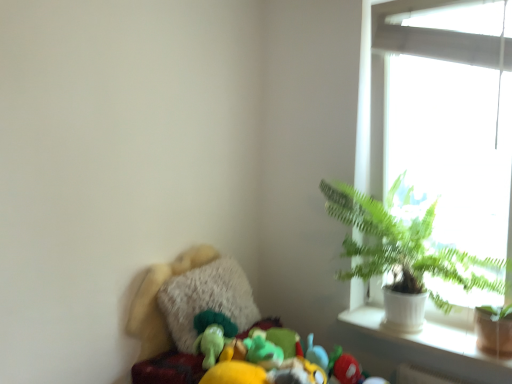
Question: Considering the relative sizes of white glass window at upper right and white ceramic pot at upper right in the image provided, is white glass window at upper right thinner than white ceramic pot at upper right?

Choices:
 (A) no
 (B) yes

Answer: (B)

Question: Can you confirm if white glass window at upper right is smaller than white ceramic pot at upper right?

Choices:
 (A) no
 (B) yes

Answer: (A)

Question: Would you say white glass window at upper right is outside white ceramic pot at upper right?

Choices:
 (A) no
 (B) yes

Answer: (B)

Question: Can you confirm if white glass window at upper right is shorter than white ceramic pot at upper right?

Choices:
 (A) no
 (B) yes

Answer: (A)

Question: From a real-world perspective, is white glass window at upper right on top of white ceramic pot at upper right?

Choices:
 (A) no
 (B) yes

Answer: (B)

Question: Can you confirm if white glass window at upper right is taller than white ceramic pot at upper right?

Choices:
 (A) no
 (B) yes

Answer: (B)

Question: From the image's perspective, is white ceramic pot at upper right on top of white ceramic pot at right?

Choices:
 (A) no
 (B) yes

Answer: (A)

Question: Is white ceramic pot at right a part of white ceramic pot at upper right?

Choices:
 (A) yes
 (B) no

Answer: (B)

Question: Is white ceramic pot at upper right bigger than white ceramic pot at right?

Choices:
 (A) yes
 (B) no

Answer: (A)

Question: Does white ceramic pot at upper right have a greater width compared to white ceramic pot at right?

Choices:
 (A) yes
 (B) no

Answer: (A)

Question: From a real-world perspective, is white ceramic pot at upper right beneath white ceramic pot at right?

Choices:
 (A) yes
 (B) no

Answer: (A)

Question: Considering the relative sizes of white ceramic pot at upper right and white ceramic pot at right in the image provided, is white ceramic pot at upper right thinner than white ceramic pot at right?

Choices:
 (A) no
 (B) yes

Answer: (A)

Question: Is green leafy plant at upper right directly adjacent to white ceramic pot at right?

Choices:
 (A) no
 (B) yes

Answer: (A)